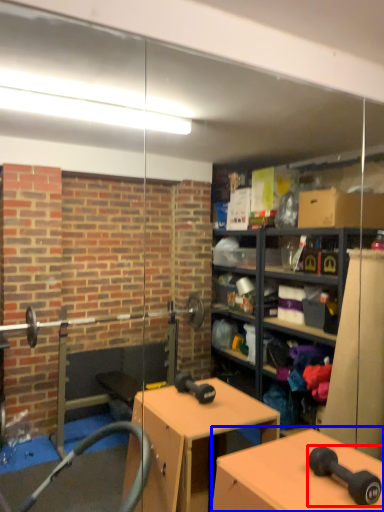
Question: Which object appears closest to the camera in this image, dumbbell (highlighted by a red box) or table (highlighted by a blue box)?

Choices:
 (A) dumbbell
 (B) table

Answer: (B)